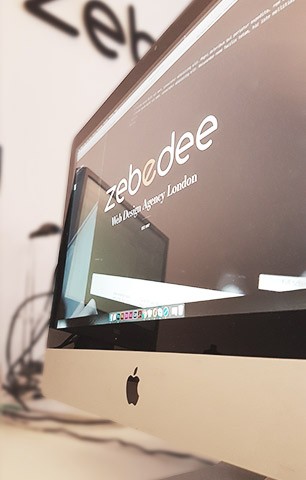
Where is `black computer cables`? This screenshot has height=480, width=306. black computer cables is located at coordinates (14, 365).